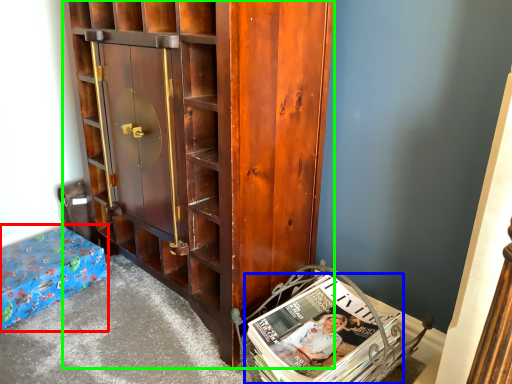
Question: Estimate the real-world distances between objects in this image. Which object is closer to furniture (highlighted by a red box), book (highlighted by a blue box) or cabinetry (highlighted by a green box)?

Choices:
 (A) book
 (B) cabinetry

Answer: (B)